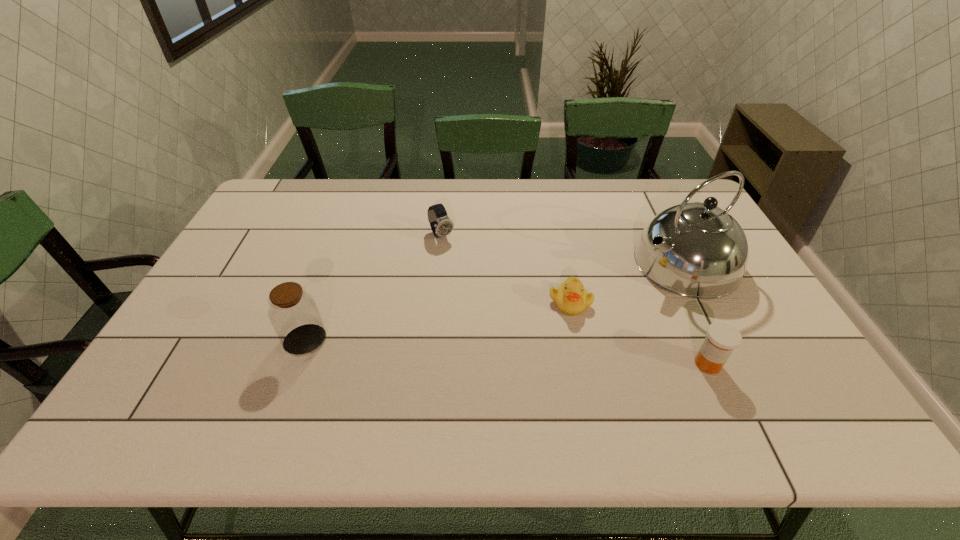
You are a GUI agent. You are given a task and a screenshot of the screen. Output one action in this format:
    pyautogui.click(x=<x>, y=<y>)
    Task: Click on the free space that is in between the kettle and the leftmost object
    The width and height of the screenshot is (960, 540).
    Given the screenshot: What is the action you would take?
    pyautogui.click(x=494, y=301)

Where is `free space that is in between the medicine and the shortest object`? The height and width of the screenshot is (540, 960). free space that is in between the medicine and the shortest object is located at coordinates (639, 333).

Find the location of `free space between the duckling and the kettle`. free space between the duckling and the kettle is located at coordinates (628, 282).

I want to click on vacant space in between the third object from right to left and the jar, so click(x=438, y=321).

At what (x,y) coordinates should I click in order to perform the action: click on free point between the third object from right to left and the jar. Please return your answer as a coordinate pair (x, y). Looking at the image, I should click on (438, 321).

Locate which object is the fourth closest to the third object from right to left. Please provide its 2D coordinates. Your answer should be formatted as a tuple, i.e. [(x, y)], where the tuple contains the x and y coordinates of a point satisfying the conditions above.

[(293, 312)]

Where is `object that is the closest to the fourth object from right to left`? Image resolution: width=960 pixels, height=540 pixels. object that is the closest to the fourth object from right to left is located at coordinates [571, 297].

Locate an element on the screen. The image size is (960, 540). free space in the image that satisfies the following two spatial constraints: 1. on the front side of the kettle; 2. on the left side of the watch is located at coordinates (439, 263).